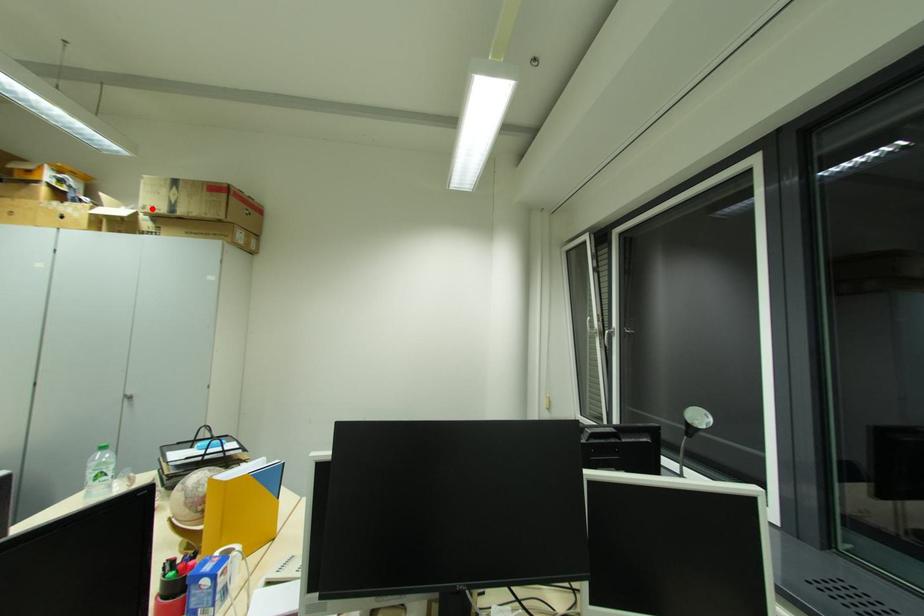
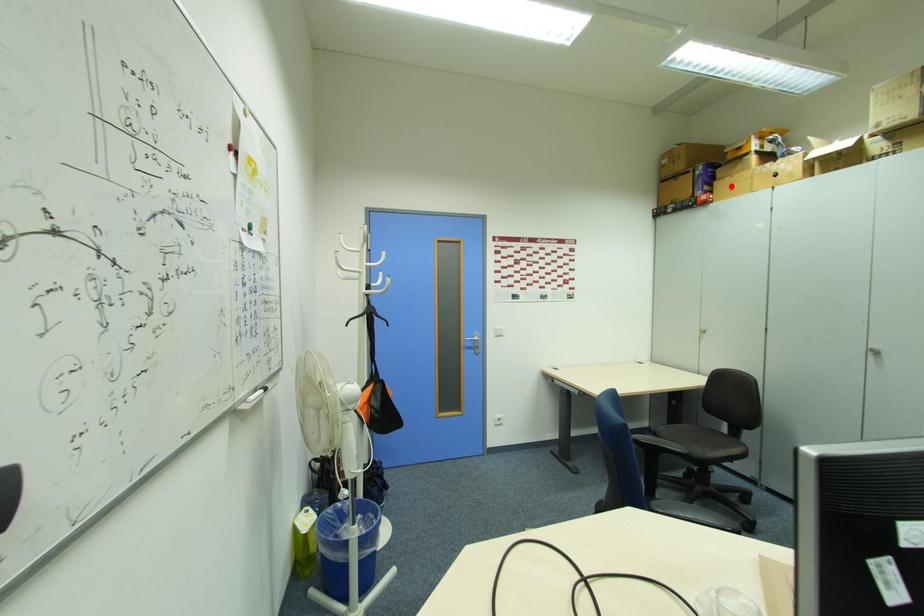
I am providing you with two images of the same scene from different viewpoints. A red point is marked on the first image and another point is marked on the second image. Is the red point in image1 aligned with the point shown in image2?

No